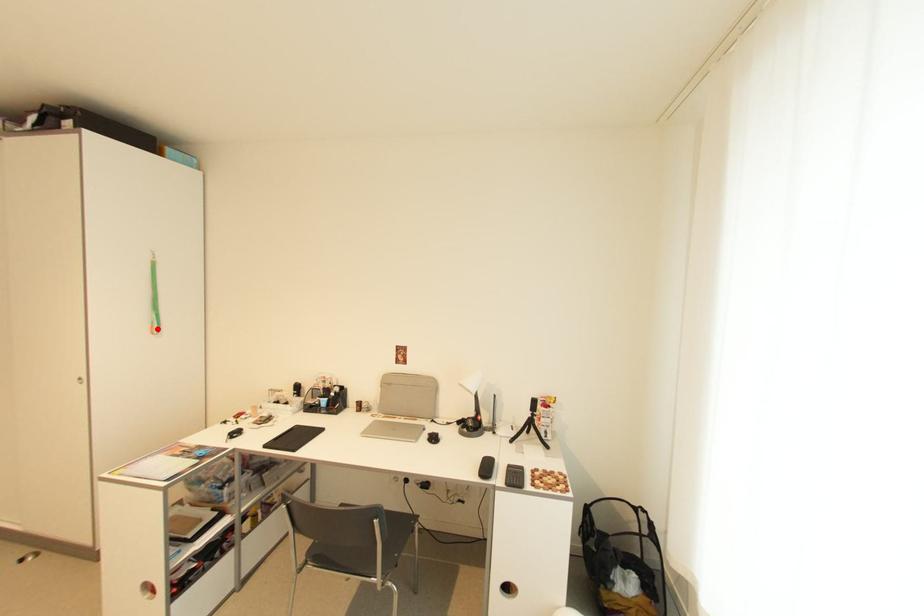
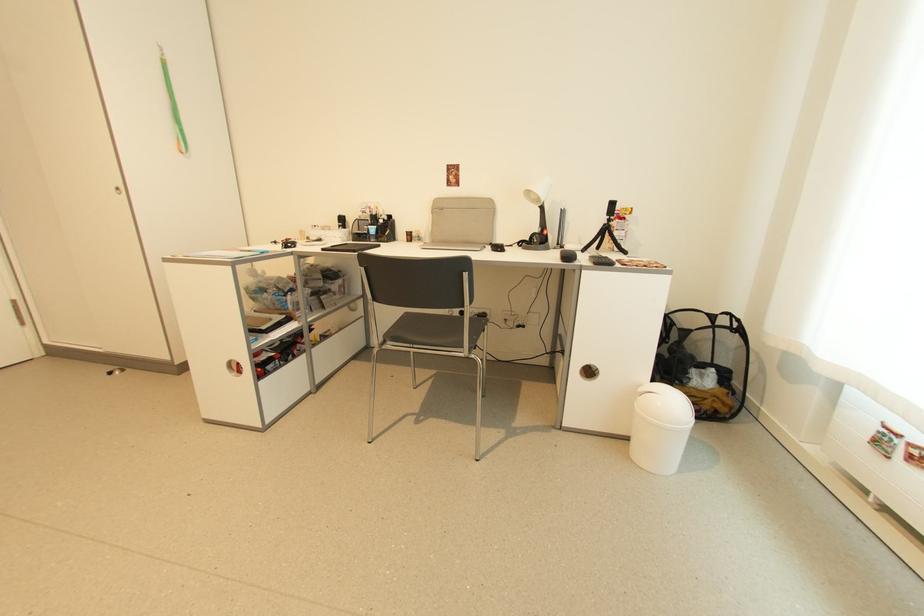
In the second image, find the point that corresponds to the highlighted location in the first image.

(185, 146)